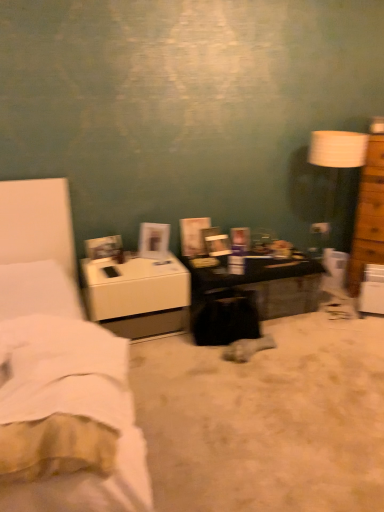
Question: Is white soft fabric bedsheet at lower left surrounded by dark brown wooden desk at center?

Choices:
 (A) yes
 (B) no

Answer: (B)

Question: From the image's perspective, is dark brown wooden desk at center over white soft fabric bedsheet at lower left?

Choices:
 (A) yes
 (B) no

Answer: (A)

Question: Is dark brown wooden desk at center behind white soft fabric bedsheet at lower left?

Choices:
 (A) no
 (B) yes

Answer: (B)

Question: Is dark brown wooden desk at center beside white soft fabric bedsheet at lower left?

Choices:
 (A) yes
 (B) no

Answer: (B)

Question: Could you tell me if dark brown wooden desk at center is turned towards white soft fabric bedsheet at lower left?

Choices:
 (A) no
 (B) yes

Answer: (A)

Question: Considering the positions of white soft fabric bedsheet at lower left and brown wooden chest of drawers at right in the image, is white soft fabric bedsheet at lower left taller or shorter than brown wooden chest of drawers at right?

Choices:
 (A) short
 (B) tall

Answer: (A)

Question: Is point (44, 407) positioned closer to the camera than point (380, 147)?

Choices:
 (A) closer
 (B) farther

Answer: (A)

Question: From the image's perspective, relative to brown wooden chest of drawers at right, is white soft fabric bedsheet at lower left above or below?

Choices:
 (A) below
 (B) above

Answer: (A)

Question: In terms of width, does white soft fabric bedsheet at lower left look wider or thinner when compared to brown wooden chest of drawers at right?

Choices:
 (A) wide
 (B) thin

Answer: (B)

Question: From the image's perspective, is brown wooden chest of drawers at right located above or below white glossy nightstand at left?

Choices:
 (A) below
 (B) above

Answer: (B)

Question: Is brown wooden chest of drawers at right inside or outside of white glossy nightstand at left?

Choices:
 (A) outside
 (B) inside

Answer: (A)

Question: Based on their positions, is brown wooden chest of drawers at right located to the left or right of white glossy nightstand at left?

Choices:
 (A) left
 (B) right

Answer: (B)

Question: From a real-world perspective, is brown wooden chest of drawers at right physically located above or below white glossy nightstand at left?

Choices:
 (A) below
 (B) above

Answer: (B)

Question: Is point (105, 352) closer or farther from the camera than point (130, 403)?

Choices:
 (A) closer
 (B) farther

Answer: (B)

Question: Relative to white fabric bed at left, is white soft fabric bedsheet at lower left in front or behind?

Choices:
 (A) behind
 (B) front

Answer: (A)